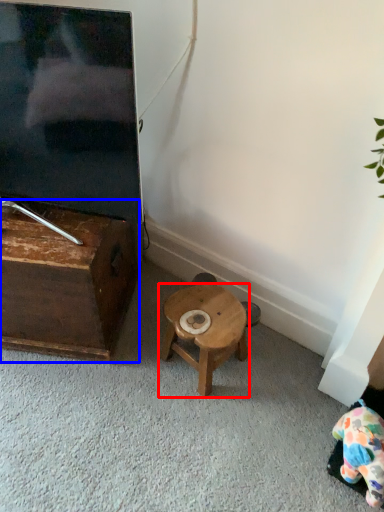
Question: Which object is closer to the camera taking this photo, stool (highlighted by a red box) or table (highlighted by a blue box)?

Choices:
 (A) stool
 (B) table

Answer: (B)